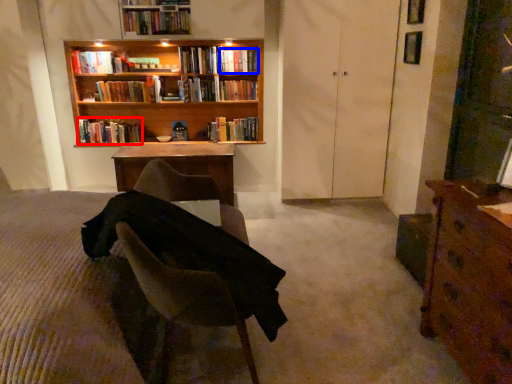
Question: Which point is closer to the camera, book (highlighted by a red box) or book (highlighted by a blue box)?

Choices:
 (A) book
 (B) book

Answer: (B)